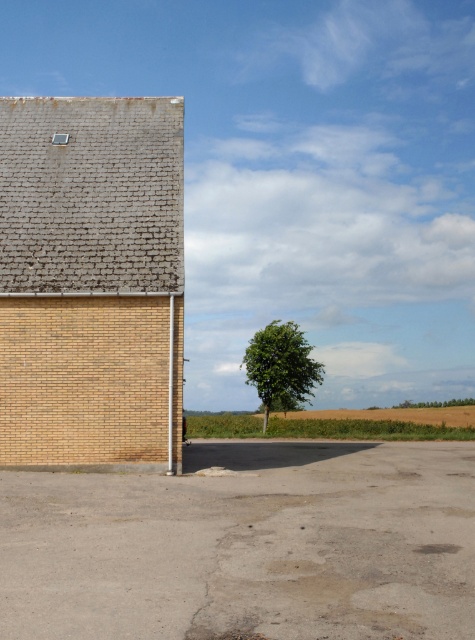
You are standing at the center of the paved area in the rural scene. You see a point marked at coordinates (92, 282). Which object in the scene does this point belong to?

The point at coordinates (92, 282) is on the brick textured barn at upper left.

What are the coordinates of the brick textured barn at upper left in the image?

The brick textured barn at upper left is located at coordinates point (92, 282).

You are a landscape architect planning to add a new tree to the scene. The new tree must be wider than the existing green leafy tree at center. Can the brick textured barn at upper left fit between the existing tree and the new tree without overlapping?

The brick textured barn at upper left is narrower than the green leafy tree at center. Since the new tree needs to be wider than the existing one, there would be insufficient space between them to place the barn without overlapping. Therefore, the barn cannot fit between them.